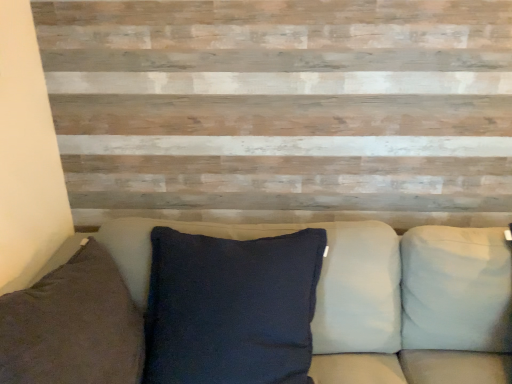
You are a GUI agent. You are given a task and a screenshot of the screen. Output one action in this format:
    pyautogui.click(x=<x>, y=<y>)
    Task: Click on the dark fabric cushion at center
    
    Given the screenshot: What is the action you would take?
    pyautogui.click(x=310, y=324)

Measure the distance between dark fabric cushion at center and camera.

dark fabric cushion at center is 1.29 meters away from camera.

This screenshot has width=512, height=384. Find the location of `dark blue fabric pillow at left, which ranks as the 2th pillow in right-to-left order`. dark blue fabric pillow at left, which ranks as the 2th pillow in right-to-left order is located at coordinates (73, 326).

The height and width of the screenshot is (384, 512). I want to click on dark fabric cushion at center, so click(310, 324).

From the picture: Is dark blue fabric pillow at left, which ranks as the 2th pillow in right-to-left order, at the left side of white fabric pillow at right, the 1th pillow positioned from the right?

Yes, dark blue fabric pillow at left, which ranks as the 2th pillow in right-to-left order, is to the left of white fabric pillow at right, the 1th pillow positioned from the right.

Is dark blue fabric pillow at left, the first pillow from the left, beside white fabric pillow at right, marked as the second pillow in a left-to-right arrangement?

dark blue fabric pillow at left, the first pillow from the left, and white fabric pillow at right, marked as the second pillow in a left-to-right arrangement, are clearly separated.

Based on their sizes in the image, would you say dark blue fabric pillow at left, the first pillow from the left, is bigger or smaller than white fabric pillow at right, the 1th pillow positioned from the right?

Considering their sizes, dark blue fabric pillow at left, the first pillow from the left, takes up more space than white fabric pillow at right, the 1th pillow positioned from the right.

From the image's perspective, which is below, dark blue fabric pillow at left, the first pillow from the left, or white fabric pillow at right, marked as the second pillow in a left-to-right arrangement?

dark blue fabric pillow at left, the first pillow from the left, from the image's perspective.

Is white fabric pillow at right, the 1th pillow positioned from the right, taller than dark fabric cushion at center?

Yes, white fabric pillow at right, the 1th pillow positioned from the right, is taller than dark fabric cushion at center.

Is white fabric pillow at right, the 1th pillow positioned from the right, placed right next to dark fabric cushion at center?

Yes, the surface of white fabric pillow at right, the 1th pillow positioned from the right, is in contact with dark fabric cushion at center.

From the image's perspective, is white fabric pillow at right, the 1th pillow positioned from the right, located above or below dark fabric cushion at center?

white fabric pillow at right, the 1th pillow positioned from the right, is below dark fabric cushion at center.

Would you say white fabric pillow at right, marked as the second pillow in a left-to-right arrangement, contains dark blue fabric pillow at left, the first pillow from the left?

No.

From the image's perspective, which one is positioned higher, white fabric pillow at right, the 1th pillow positioned from the right, or dark blue fabric pillow at left, the first pillow from the left?

white fabric pillow at right, the 1th pillow positioned from the right.

Consider the image. Which of these two, white fabric pillow at right, the 1th pillow positioned from the right, or dark blue fabric pillow at left, which ranks as the 2th pillow in right-to-left order, is thinner?

white fabric pillow at right, the 1th pillow positioned from the right.

Where is `pillow on the right of dark blue fabric pillow at left, which ranks as the 2th pillow in right-to-left order`? The image size is (512, 384). pillow on the right of dark blue fabric pillow at left, which ranks as the 2th pillow in right-to-left order is located at coordinates (456, 289).

How far apart are dark fabric cushion at center and white fabric pillow at right, the 1th pillow positioned from the right?

A distance of 3.17 centimeters exists between dark fabric cushion at center and white fabric pillow at right, the 1th pillow positioned from the right.

Considering the relative positions of dark fabric cushion at center and white fabric pillow at right, marked as the second pillow in a left-to-right arrangement, in the image provided, is dark fabric cushion at center to the left of white fabric pillow at right, marked as the second pillow in a left-to-right arrangement, from the viewer's perspective?

Indeed, dark fabric cushion at center is positioned on the left side of white fabric pillow at right, marked as the second pillow in a left-to-right arrangement.

Is dark fabric cushion at center next to white fabric pillow at right, marked as the second pillow in a left-to-right arrangement?

Yes, dark fabric cushion at center is in contact with white fabric pillow at right, marked as the second pillow in a left-to-right arrangement.

Locate an element on the screen. studio couch on the right side of dark blue fabric pillow at left, the first pillow from the left is located at coordinates (310, 324).

Is dark blue fabric pillow at left, which ranks as the 2th pillow in right-to-left order, facing away from dark fabric cushion at center?

No.

Is dark fabric cushion at center inside or outside of dark blue fabric pillow at left, which ranks as the 2th pillow in right-to-left order?

dark fabric cushion at center is not inside dark blue fabric pillow at left, which ranks as the 2th pillow in right-to-left order, it's outside.

In the image, there is a dark blue fabric pillow at left, which ranks as the 2th pillow in right-to-left order. Where is `studio couch below it (from a real-world perspective)`? The height and width of the screenshot is (384, 512). studio couch below it (from a real-world perspective) is located at coordinates (310, 324).

Is dark fabric cushion at center positioned with its back to dark blue fabric pillow at left, the first pillow from the left?

No.

There is a white fabric pillow at right, the 1th pillow positioned from the right. At what (x,y) coordinates should I click in order to perform the action: click on pillow above it (from a real-world perspective). Please return your answer as a coordinate pair (x, y). This screenshot has height=384, width=512. Looking at the image, I should click on (73, 326).

This screenshot has width=512, height=384. I want to click on studio couch that appears on the left of white fabric pillow at right, marked as the second pillow in a left-to-right arrangement, so click(x=310, y=324).

Looking at this image, when comparing their distances from dark blue fabric pillow at left, which ranks as the 2th pillow in right-to-left order, does dark fabric cushion at center or white fabric pillow at right, the 1th pillow positioned from the right, seem further?

white fabric pillow at right, the 1th pillow positioned from the right, is further to dark blue fabric pillow at left, which ranks as the 2th pillow in right-to-left order.

Looking at the image, which one is located closer to dark fabric cushion at center, white fabric pillow at right, marked as the second pillow in a left-to-right arrangement, or dark blue fabric pillow at left, which ranks as the 2th pillow in right-to-left order?

Based on the image, white fabric pillow at right, marked as the second pillow in a left-to-right arrangement, appears to be nearer to dark fabric cushion at center.

Considering their positions, is dark blue fabric pillow at left, which ranks as the 2th pillow in right-to-left order, positioned further to white fabric pillow at right, marked as the second pillow in a left-to-right arrangement, than dark fabric cushion at center?

dark blue fabric pillow at left, which ranks as the 2th pillow in right-to-left order, lies further to white fabric pillow at right, marked as the second pillow in a left-to-right arrangement, than the other object.

Based on their spatial positions, is white fabric pillow at right, the 1th pillow positioned from the right, or dark fabric cushion at center further from dark blue fabric pillow at left, the first pillow from the left?

white fabric pillow at right, the 1th pillow positioned from the right, is further to dark blue fabric pillow at left, the first pillow from the left.

Based on their spatial positions, is dark blue fabric pillow at left, which ranks as the 2th pillow in right-to-left order, or white fabric pillow at right, the 1th pillow positioned from the right, closer to dark fabric cushion at center?

The object closer to dark fabric cushion at center is white fabric pillow at right, the 1th pillow positioned from the right.

Based on their spatial positions, is dark fabric cushion at center or dark blue fabric pillow at left, which ranks as the 2th pillow in right-to-left order, closer to white fabric pillow at right, marked as the second pillow in a left-to-right arrangement?

dark fabric cushion at center is positioned closer to the anchor white fabric pillow at right, marked as the second pillow in a left-to-right arrangement.

Where is `studio couch between dark blue fabric pillow at left, which ranks as the 2th pillow in right-to-left order, and white fabric pillow at right, marked as the second pillow in a left-to-right arrangement, from left to right`? The width and height of the screenshot is (512, 384). studio couch between dark blue fabric pillow at left, which ranks as the 2th pillow in right-to-left order, and white fabric pillow at right, marked as the second pillow in a left-to-right arrangement, from left to right is located at coordinates (310, 324).